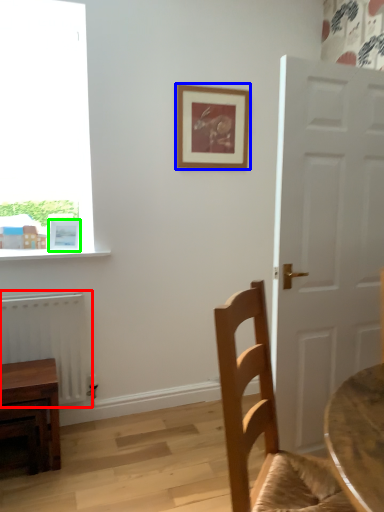
Question: Considering the real-world distances, which object is closest to radiator (highlighted by a red box)? picture frame (highlighted by a blue box) or picture frame (highlighted by a green box).

Choices:
 (A) picture frame
 (B) picture frame

Answer: (B)